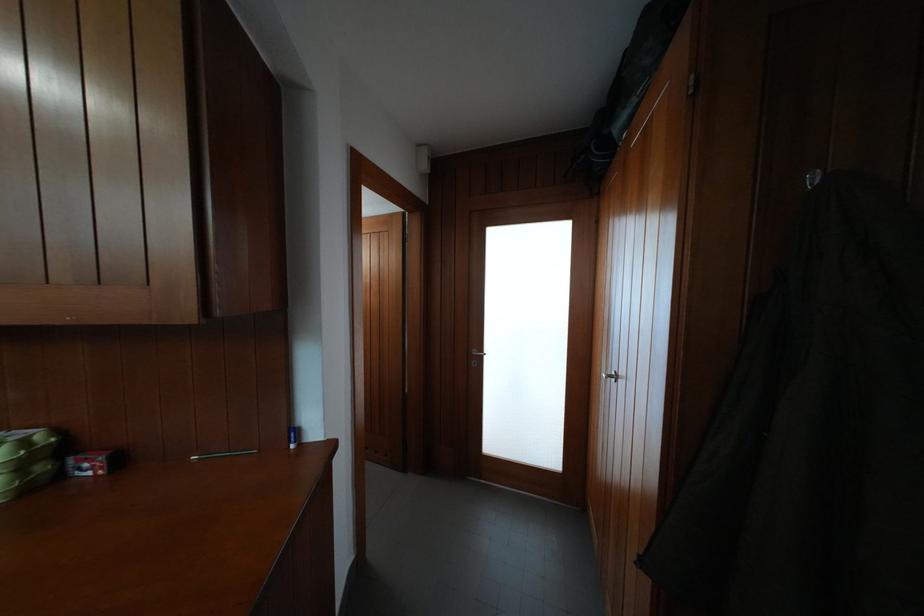
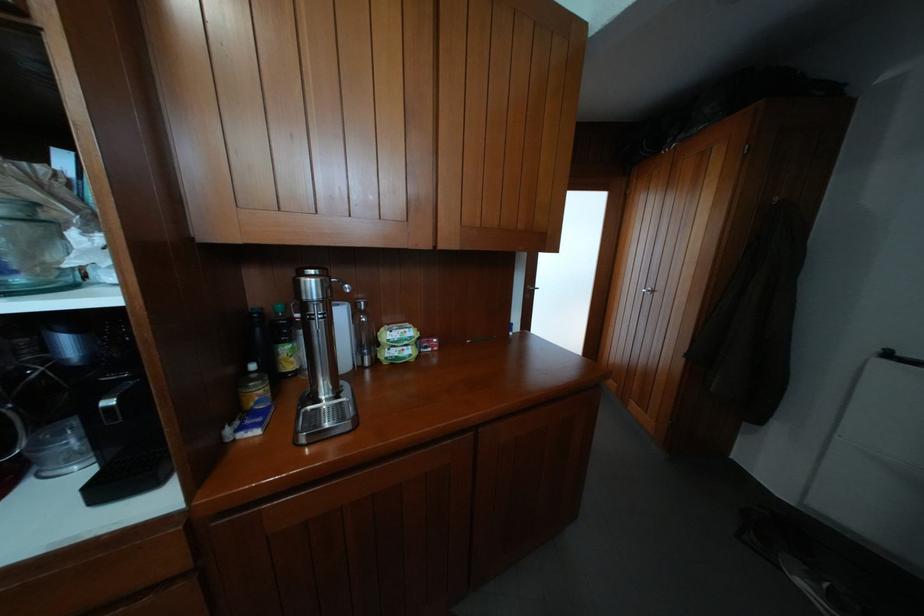
Question: What movement of the cameraman would produce the second image?

Choices:
 (A) Left
 (B) Right
 (C) Forward
 (D) Backward

Answer: (A)